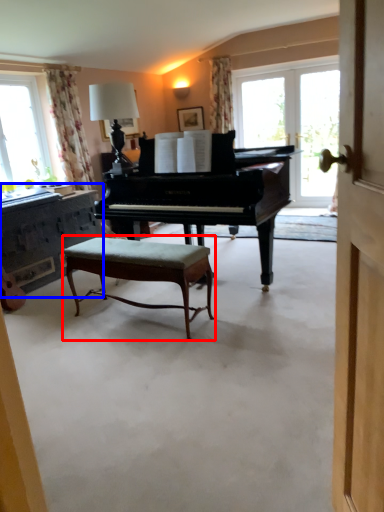
Question: Which of the following is the farthest to the observer, stool (highlighted by a red box) or dresser (highlighted by a blue box)?

Choices:
 (A) stool
 (B) dresser

Answer: (B)